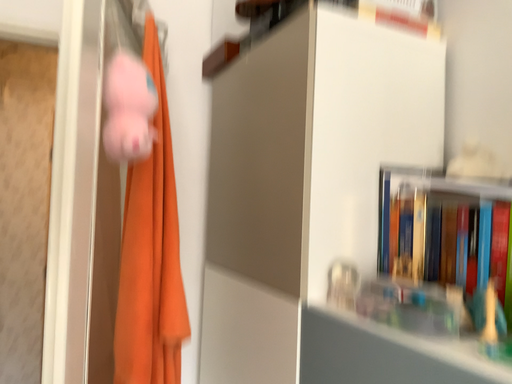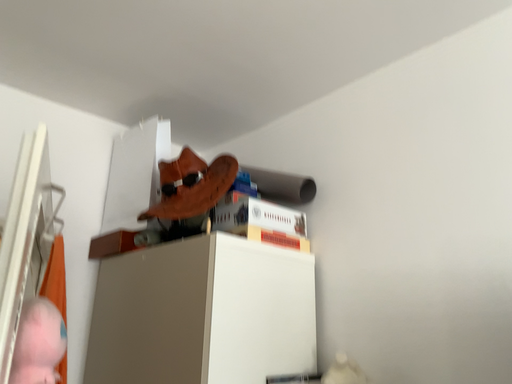
Question: How did the camera likely rotate when shooting the video?

Choices:
 (A) rotated upward
 (B) rotated downward

Answer: (A)